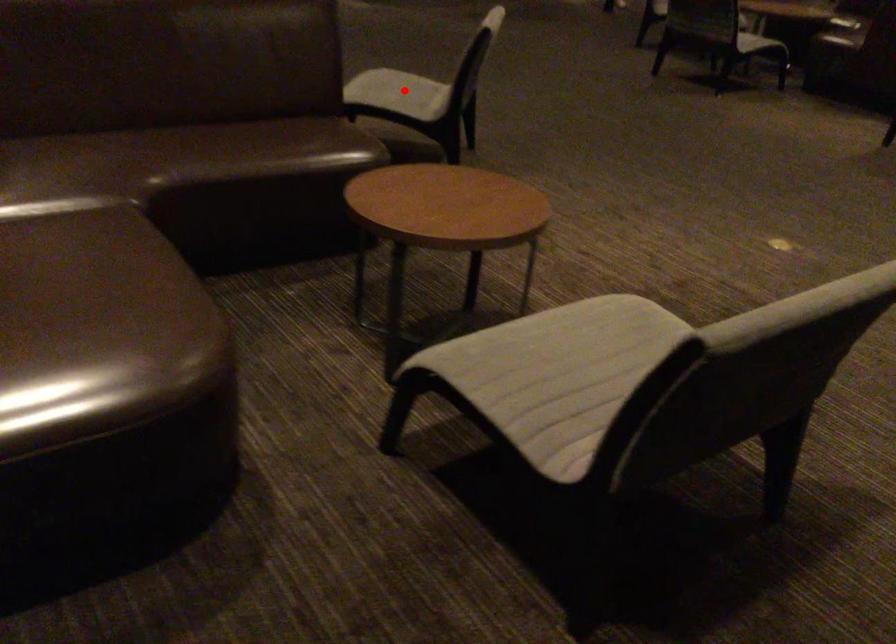
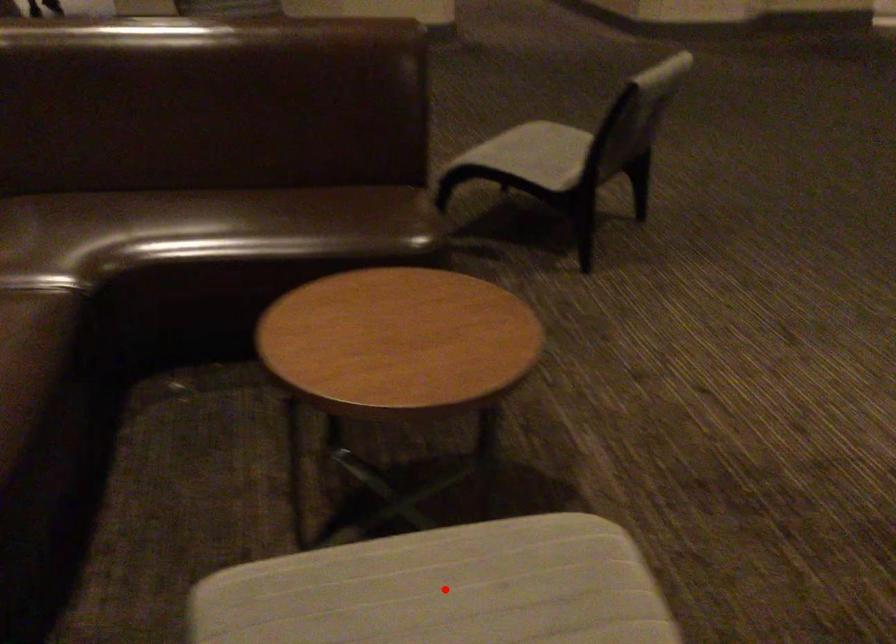
I am providing you with two images of the same scene from different viewpoints. A red point is marked on the first image and another point is marked on the second image. Do the highlighted points in image1 and image2 indicate the same real-world spot?

No